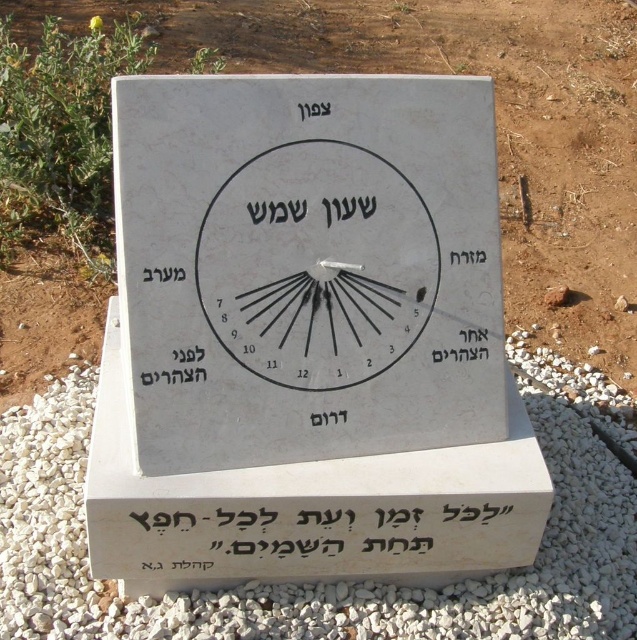
Question: Observing the image, what is the correct spatial positioning of brown soil at center in reference to white gravel at lower center?

Choices:
 (A) below
 (B) above

Answer: (B)

Question: Can you confirm if white stone sundial at center is thinner than brown soil at center?

Choices:
 (A) no
 (B) yes

Answer: (B)

Question: Among these points, which one is farthest from the camera?

Choices:
 (A) (396, 289)
 (B) (322, 449)

Answer: (A)

Question: Which point is farther to the camera?

Choices:
 (A) white gravel at lower center
 (B) white stone clock at center
 (C) brown soil at center

Answer: (C)

Question: Which point appears farthest from the camera in this image?

Choices:
 (A) (241, 180)
 (B) (55, 476)

Answer: (B)

Question: Does white stone sundial at center have a greater width compared to brown soil at center?

Choices:
 (A) yes
 (B) no

Answer: (B)